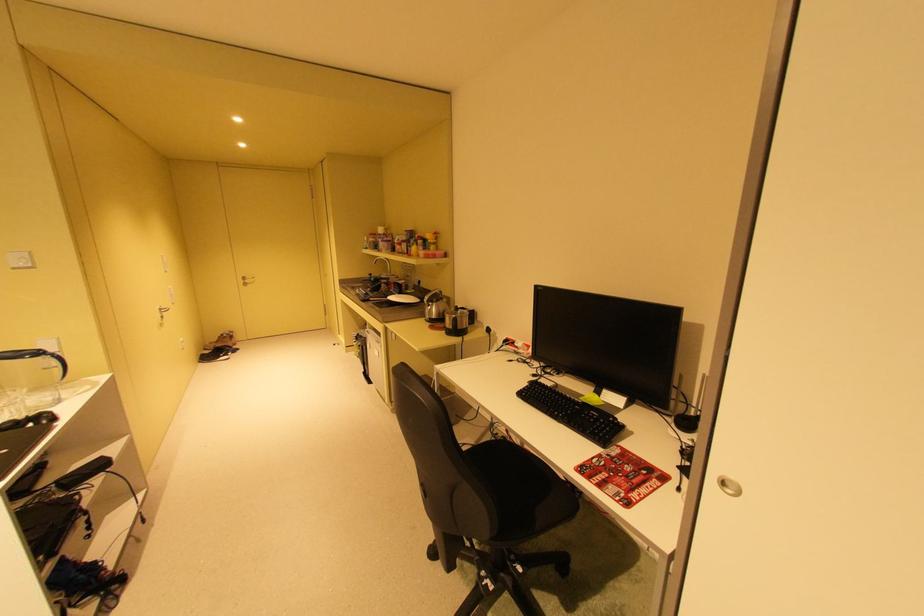
Identify the location of chair sitting surface. This screenshot has width=924, height=616. (521, 487).